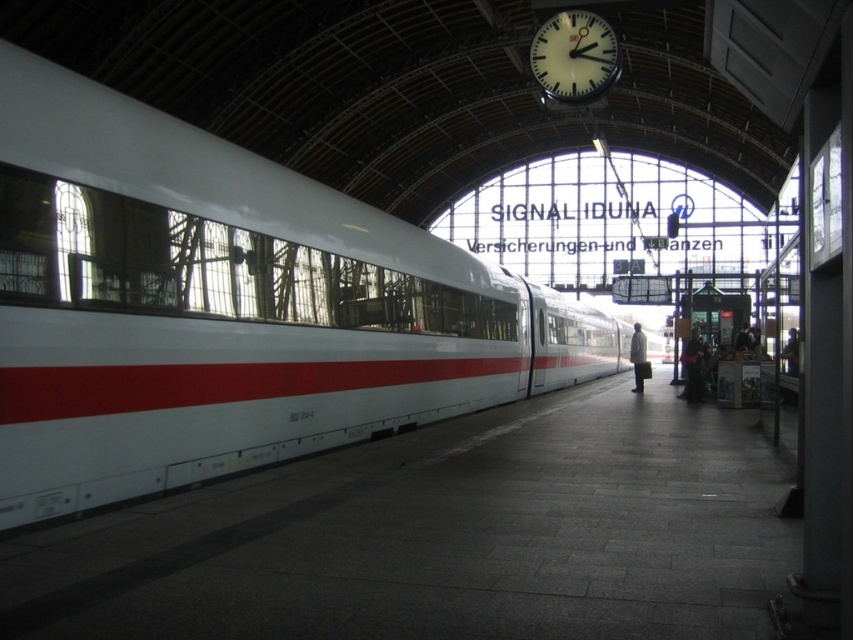
You are a passenger waiting at the train station platform. You notice a person wearing a white matte coat at center and another person with a smooth skin face at right. Which object is positioned lower in the image?

The white matte coat at center is located below the smooth skin face at right, so the white matte coat at center is positioned lower in the image.

You are a photographer trying to capture both the white matte coat at center and the smooth skin face at right in a single shot. Based on their positions and sizes, can you fit both into the frame without cropping either of them?

The white matte coat at center might be wider than smooth skin face at right, so there is a possibility that both can fit into the frame if positioned correctly, but it depends on the camera angle and zoom level.